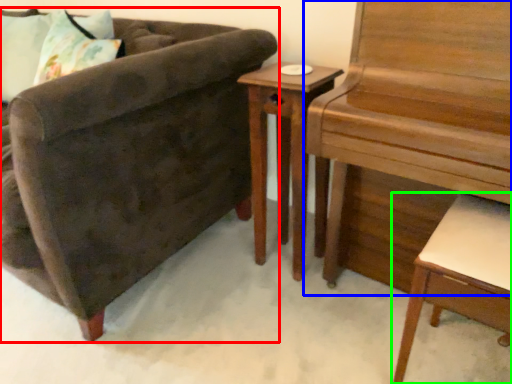
Question: Based on their relative distances, which object is farther from chair (highlighted by a red box)? Choose from piano (highlighted by a blue box) and desk (highlighted by a green box).

Choices:
 (A) piano
 (B) desk

Answer: (B)